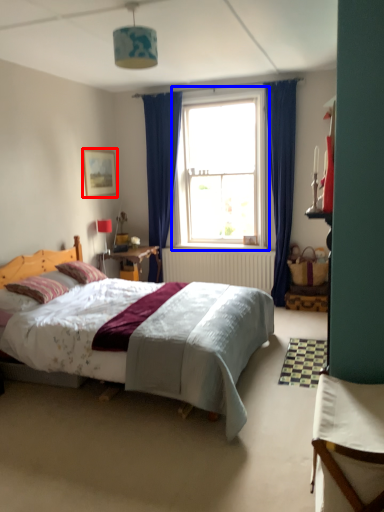
Question: Which of the following is the farthest to the observer, picture frame (highlighted by a red box) or window (highlighted by a blue box)?

Choices:
 (A) picture frame
 (B) window

Answer: (A)